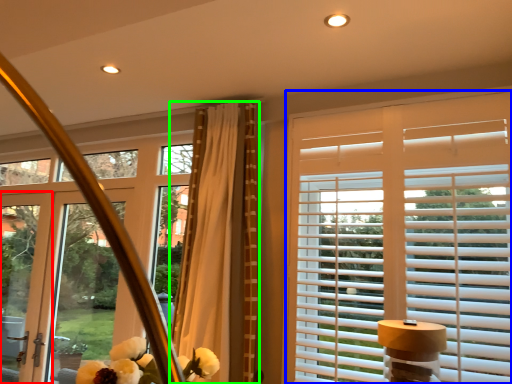
Question: Based on their relative distances, which object is farther from screen door (highlighted by a red box)? Choose from window blind (highlighted by a blue box) and curtain (highlighted by a green box).

Choices:
 (A) window blind
 (B) curtain

Answer: (A)